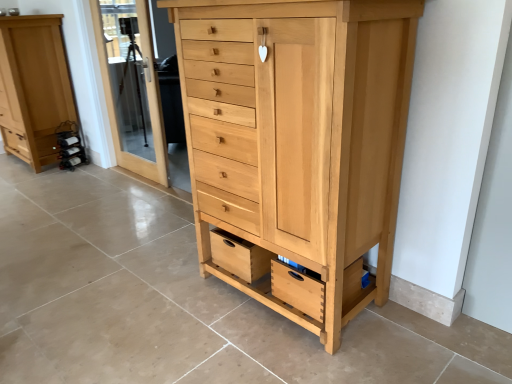
Question: Considering the relative sizes of transparent glass door at upper left and natural wood drawer at lower center in the image provided, is transparent glass door at upper left thinner than natural wood drawer at lower center?

Choices:
 (A) no
 (B) yes

Answer: (B)

Question: Is transparent glass door at upper left positioned with its back to natural wood drawer at lower center?

Choices:
 (A) yes
 (B) no

Answer: (B)

Question: From a real-world perspective, is transparent glass door at upper left below natural wood drawer at lower center?

Choices:
 (A) yes
 (B) no

Answer: (B)

Question: Does transparent glass door at upper left appear on the left side of natural wood drawer at lower center?

Choices:
 (A) no
 (B) yes

Answer: (B)

Question: Can you confirm if transparent glass door at upper left is taller than natural wood drawer at lower center?

Choices:
 (A) yes
 (B) no

Answer: (A)

Question: Is point (336, 309) closer or farther from the camera than point (230, 233)?

Choices:
 (A) farther
 (B) closer

Answer: (B)

Question: Is natural wood chest of drawers at center, acting as the second chest of drawers starting from the back, in front of or behind natural wood drawer at lower center in the image?

Choices:
 (A) front
 (B) behind

Answer: (A)

Question: Is natural wood chest of drawers at center, the second chest of drawers from the left, taller or shorter than natural wood drawer at lower center?

Choices:
 (A) tall
 (B) short

Answer: (A)

Question: Looking at the image, does natural wood chest of drawers at center, which is the first chest of drawers in front-to-back order, seem bigger or smaller compared to natural wood drawer at lower center?

Choices:
 (A) big
 (B) small

Answer: (A)

Question: Is natural wood drawer at lower center situated inside natural wood chest of drawers at center, which is the first chest of drawers in front-to-back order, or outside?

Choices:
 (A) outside
 (B) inside

Answer: (B)

Question: Looking at their shapes, would you say natural wood drawer at lower center is wider or thinner than natural wood chest of drawers at center, which is the first chest of drawers in front-to-back order?

Choices:
 (A) wide
 (B) thin

Answer: (B)

Question: Visually, is natural wood drawer at lower center positioned to the left or to the right of natural wood chest of drawers at center, the second chest of drawers from the left?

Choices:
 (A) left
 (B) right

Answer: (A)

Question: From the image's perspective, is natural wood drawer at lower center above or below natural wood chest of drawers at center, acting as the second chest of drawers starting from the back?

Choices:
 (A) below
 (B) above

Answer: (A)

Question: Do you think transparent glass door at upper left is within natural wood chest of drawers at center, marked as the first chest of drawers in a right-to-left arrangement, or outside of it?

Choices:
 (A) outside
 (B) inside

Answer: (A)

Question: From a real-world perspective, is transparent glass door at upper left positioned above or below natural wood chest of drawers at center, the second chest of drawers from the left?

Choices:
 (A) below
 (B) above

Answer: (B)